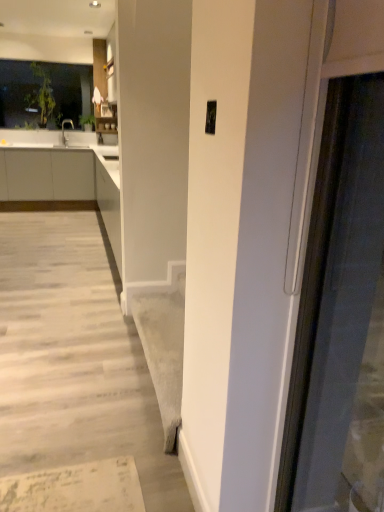
Question: Relative to matte silver faucet at upper left, is transparent glass window at upper left in front or behind?

Choices:
 (A) front
 (B) behind

Answer: (A)

Question: Does point (59, 100) appear closer or farther from the camera than point (72, 128)?

Choices:
 (A) closer
 (B) farther

Answer: (A)

Question: Based on their relative distances, which object is nearer to the transparent glass window at upper left?

Choices:
 (A) white matte cabinetry at left
 (B) matte silver faucet at upper left

Answer: (B)

Question: Estimate the real-world distances between objects in this image. Which object is farther from the matte silver faucet at upper left?

Choices:
 (A) white matte cabinetry at left
 (B) transparent glass window at upper left

Answer: (A)